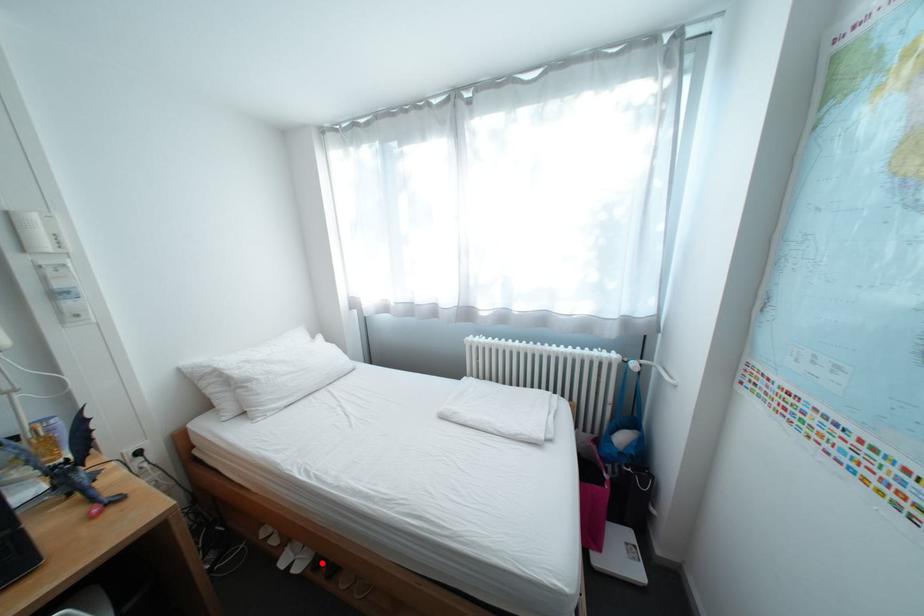
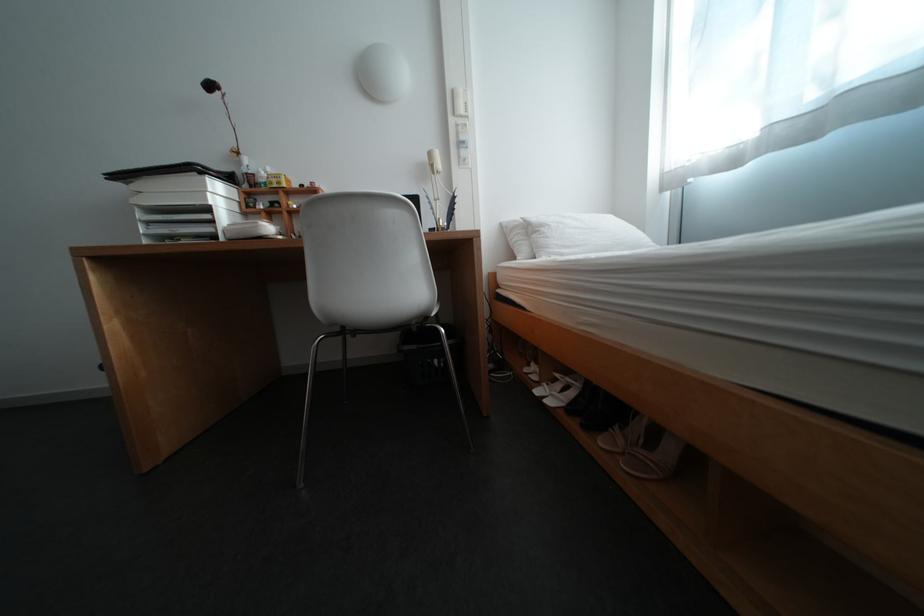
Question: I am providing you with two images of the same scene from different viewpoints. A red point is shown in image1. For the corresponding object point in image2, is it positioned nearer or farther from the camera?

Choices:
 (A) Nearer
 (B) Farther

Answer: (A)